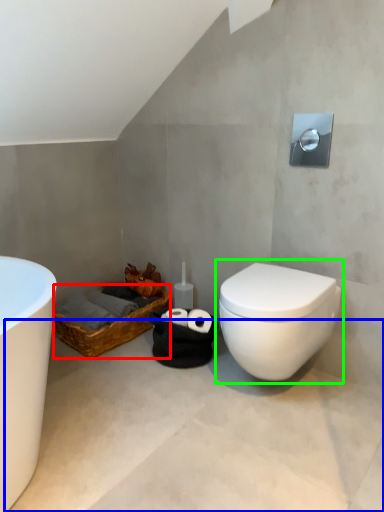
Question: Based on their relative distances, which object is farther from basket (highlighted by a red box)? Choose from concrete (highlighted by a blue box) and toilet (highlighted by a green box).

Choices:
 (A) concrete
 (B) toilet

Answer: (B)